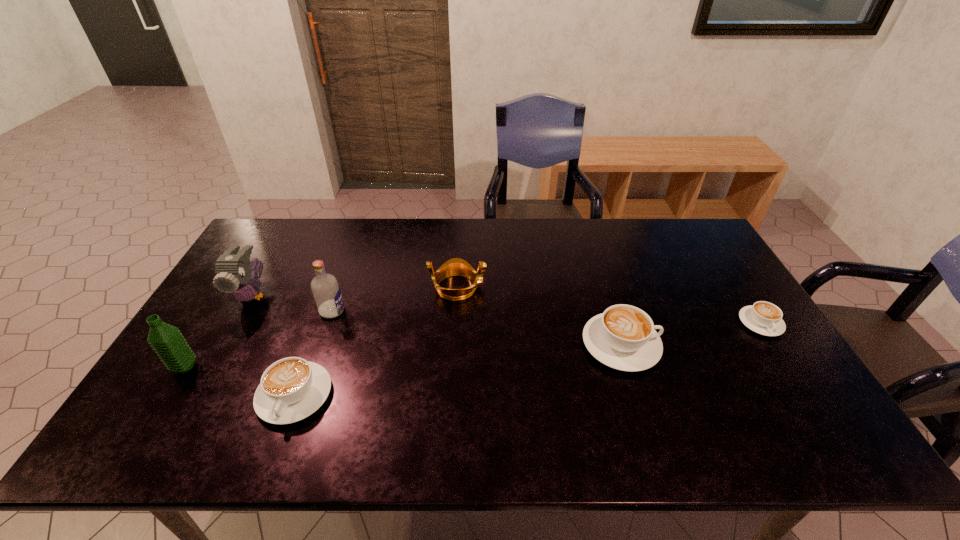
At what (x,y) coordinates should I click in order to perform the action: click on the second shortest object. Please return your answer as a coordinate pair (x, y). The width and height of the screenshot is (960, 540). Looking at the image, I should click on (291, 389).

Locate an element on the screen. The height and width of the screenshot is (540, 960). the second tallest cappuccino is located at coordinates (291, 389).

Locate an element on the screen. The image size is (960, 540). the sixth object from left to right is located at coordinates (623, 337).

Find the location of a particular element. the shortest object is located at coordinates (765, 318).

You are a GUI agent. You are given a task and a screenshot of the screen. Output one action in this format:
    pyautogui.click(x=<x>, y=<y>)
    Task: Click on the rightmost cappuccino
    The image size is (960, 540).
    Given the screenshot: What is the action you would take?
    pyautogui.click(x=765, y=318)

Find the location of a particular element. This screenshot has width=960, height=540. vodka is located at coordinates (326, 291).

Locate an element on the screen. the second object from left to right is located at coordinates (235, 274).

At what (x,y) coordinates should I click in order to perform the action: click on the third object from right to left. Please return your answer as a coordinate pair (x, y). The image size is (960, 540). Looking at the image, I should click on (454, 267).

Where is `the leftmost object`? The width and height of the screenshot is (960, 540). the leftmost object is located at coordinates (167, 341).

Locate an element on the screen. vacant space located on the side of the second cappuccino from right to left with the handle is located at coordinates (688, 345).